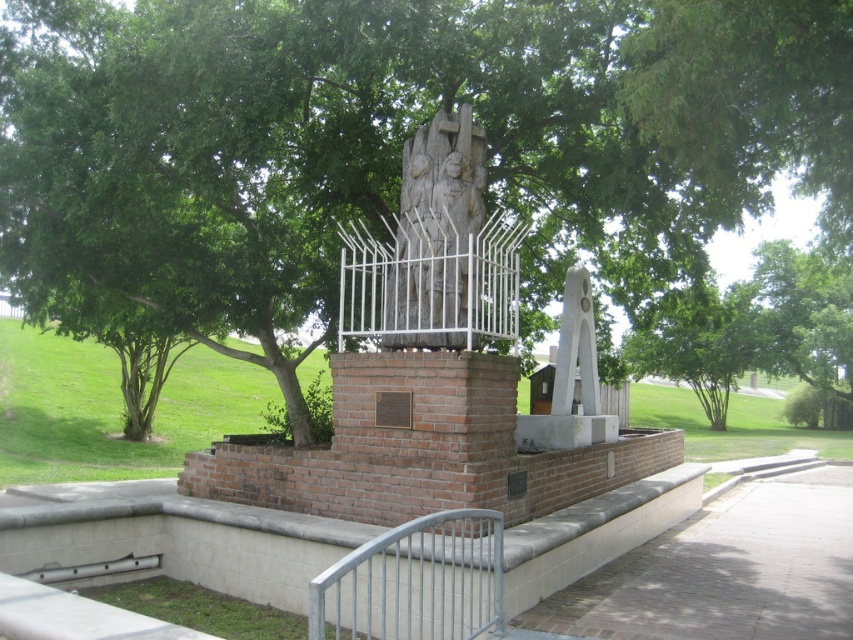
You are a visitor at the memorial and want to place a bouquet of flowers between the silver metallic fence at lower center and the carved stone sculpture at center. Which object should you place the flowers closer to if you want them to be as far as possible from the fence?

You should place the bouquet closer to the carved stone sculpture at center because the silver metallic fence at lower center is wider than the sculpture, creating more space between them. This ensures the flowers are farther from the fence.

You are a visitor at the memorial and want to take a photo that includes both the green leafy tree at center and the carved stone sculpture at center. Which object should you position closer to the camera to ensure both are in focus?

The carved stone sculpture at center is smaller than the green leafy tree at center, so positioning the camera closer to the carved stone sculpture at center will help ensure both are in focus.